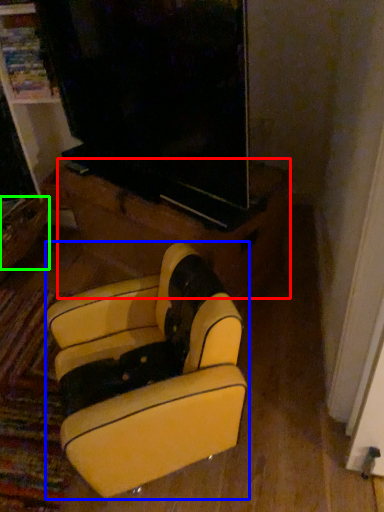
Question: Considering the real-world distances, which object is closest to furniture (highlighted by a red box)? furniture (highlighted by a blue box) or drawer (highlighted by a green box).

Choices:
 (A) furniture
 (B) drawer

Answer: (A)